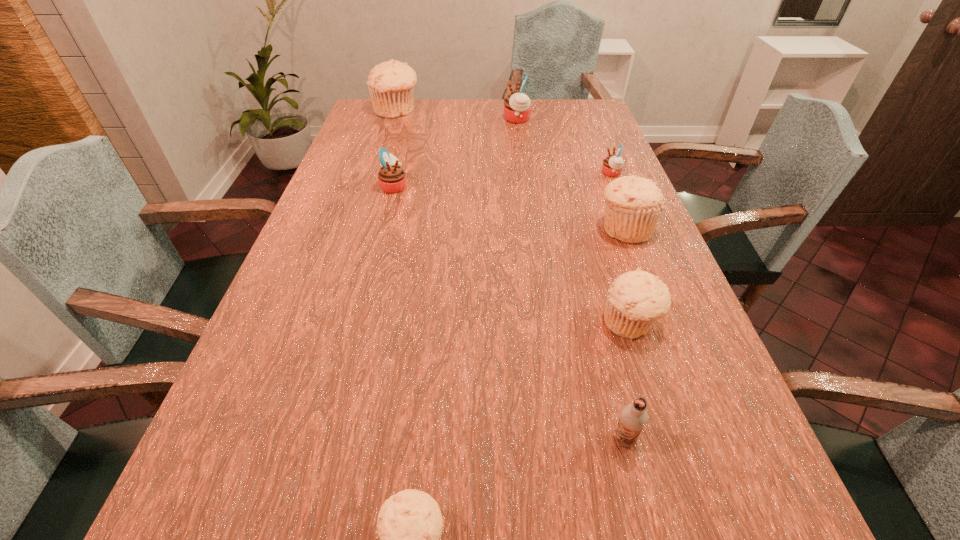
I want to click on free location located 0.300m on the front-facing side of the smallest pink muffin, so click(501, 173).

The image size is (960, 540). What are the coordinates of `vacant region located 0.400m on the front-facing side of the smallest pink muffin` in the screenshot? It's located at (468, 173).

Locate an element on the screen. Image resolution: width=960 pixels, height=540 pixels. object present at the far left corner is located at coordinates (391, 84).

In the image, there is a desktop. Find the location of `vacant space at the far edge`. vacant space at the far edge is located at coordinates (503, 111).

The image size is (960, 540). What are the coordinates of `vacant space at the left edge of the desktop` in the screenshot? It's located at (324, 208).

Locate an element on the screen. vacant space at the right edge of the desktop is located at coordinates (593, 177).

In the image, there is a desktop. Where is `vacant region at the far left corner`? The height and width of the screenshot is (540, 960). vacant region at the far left corner is located at coordinates (361, 117).

Identify the location of vacant area that lies between the third nearest beige muffin and the biggest beige muffin. (511, 170).

At what (x,y) coordinates should I click in order to perform the action: click on vacant space that is in between the second smallest beige muffin and the rightmost pink muffin. Please return your answer as a coordinate pair (x, y). Looking at the image, I should click on point(621,248).

The image size is (960, 540). What are the coordinates of `vacant region between the smallest pink muffin and the biggest pink muffin` in the screenshot? It's located at (564, 146).